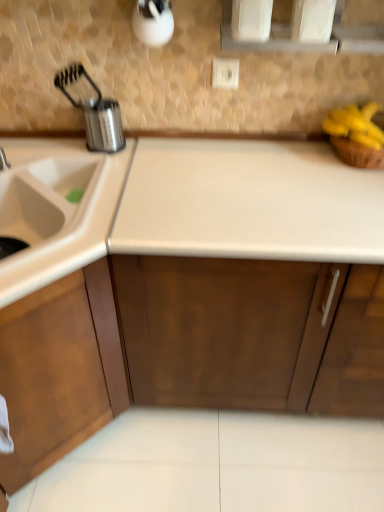
What are the coordinates of `free space above yellow matte bananas at upper right (from a real-world perspective)` in the screenshot? It's located at (371, 108).